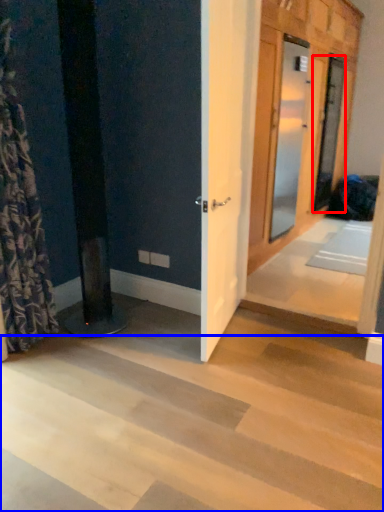
Question: Which point is further to the camera, door (highlighted by a red box) or stairwell (highlighted by a blue box)?

Choices:
 (A) door
 (B) stairwell

Answer: (A)